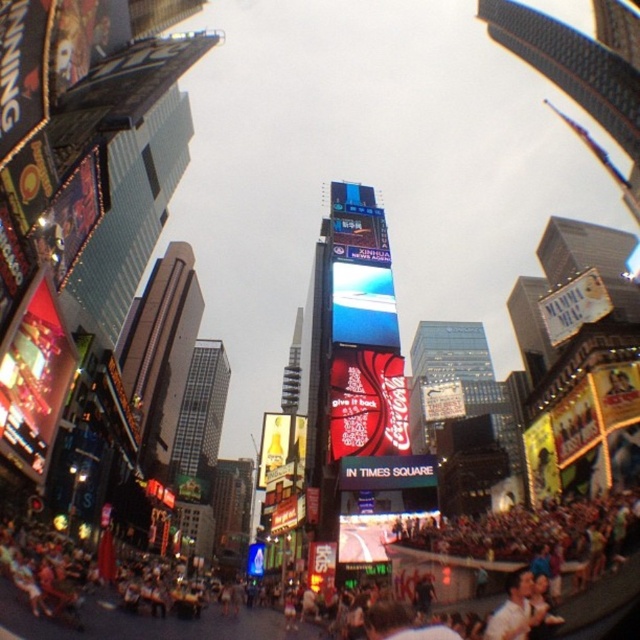
Can you confirm if human skin textured crowd at lower center is shorter than light brown hair at lower right?

In fact, human skin textured crowd at lower center may be taller than light brown hair at lower right.

Does human skin textured crowd at lower center have a lesser width compared to light brown hair at lower right?

A: No.

Which is in front, point (589, 586) or point (529, 593)?

Positioned in front is point (529, 593).

You are a GUI agent. You are given a task and a screenshot of the screen. Output one action in this format:
    pyautogui.click(x=<x>, y=<y>)
    Task: Click on the human skin textured crowd at lower center
    Image resolution: width=640 pixels, height=640 pixels.
    Given the screenshot: What is the action you would take?
    pyautogui.click(x=118, y=602)